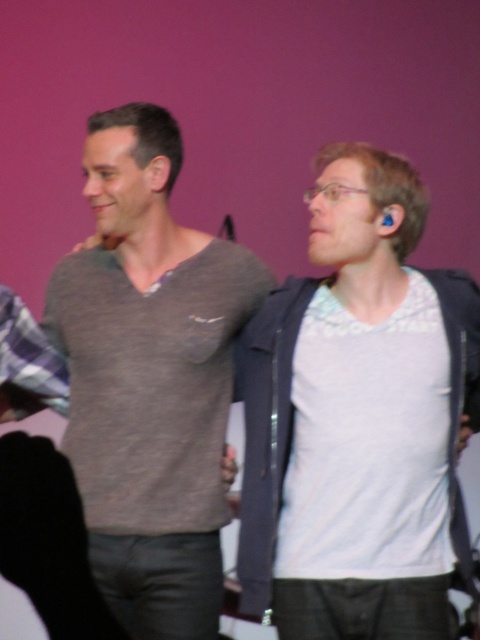
Question: Among these objects, which one is nearest to the camera?

Choices:
 (A) gray matte sweater at center
 (B) gray soft sweater at center

Answer: (A)

Question: Is the position of gray soft sweater at center more distant than that of gray matte sweater at center?

Choices:
 (A) no
 (B) yes

Answer: (B)

Question: From the image, what is the correct spatial relationship of gray soft sweater at center in relation to gray matte sweater at center?

Choices:
 (A) right
 (B) left

Answer: (B)

Question: Is gray soft sweater at center to the left of gray matte sweater at center from the viewer's perspective?

Choices:
 (A) yes
 (B) no

Answer: (A)